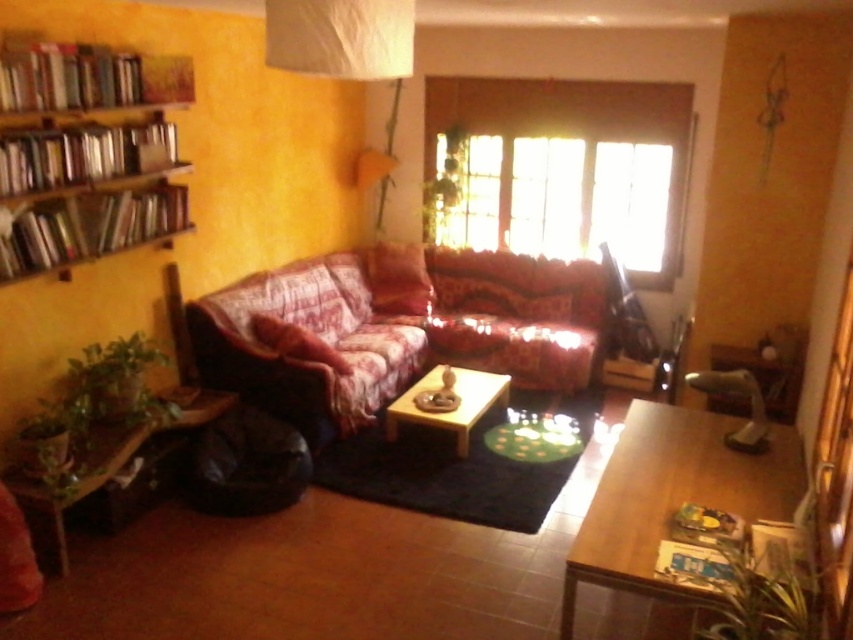
You are standing in the living room and want to move from the sofa to the bookshelf. The sofa is located at point [10,132] and the bookshelf is at point [630,490]. Which direction should you move to reach the bookshelf?

To reach the bookshelf at point [630,490] from the sofa at point [10,132], you should move forward since the sofa is behind the bookshelf.

You are a delivery person with a package that is 1.2 meters long. You need to place it between the floral fabric couch at center and the green wood table at lower left. Is there enough space to fit the package between them?

The distance between the floral fabric couch at center and the green wood table at lower left is 1.12 meters. Since the package is 1.2 meters long, it will not fit between them as the space is shorter than the package.

Based on the photo, you are standing at the center of the living room and want to place a new painting on the wall. The painting requires a hook that must be placed exactly at point coordinates of 0.241, 0.102. Can you hang the painting on the wooden shelves at left?

The wooden shelves at left are located at coordinates (86,154), so you can hang the painting there.